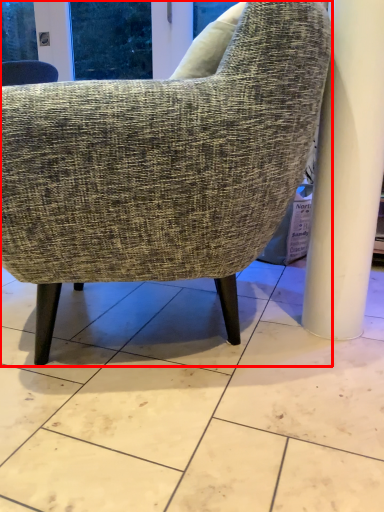
Question: Considering the relative positions of chair (annotated by the red box) and concrete in the image provided, where is chair (annotated by the red box) located with respect to the staircase?

Choices:
 (A) left
 (B) right

Answer: (B)